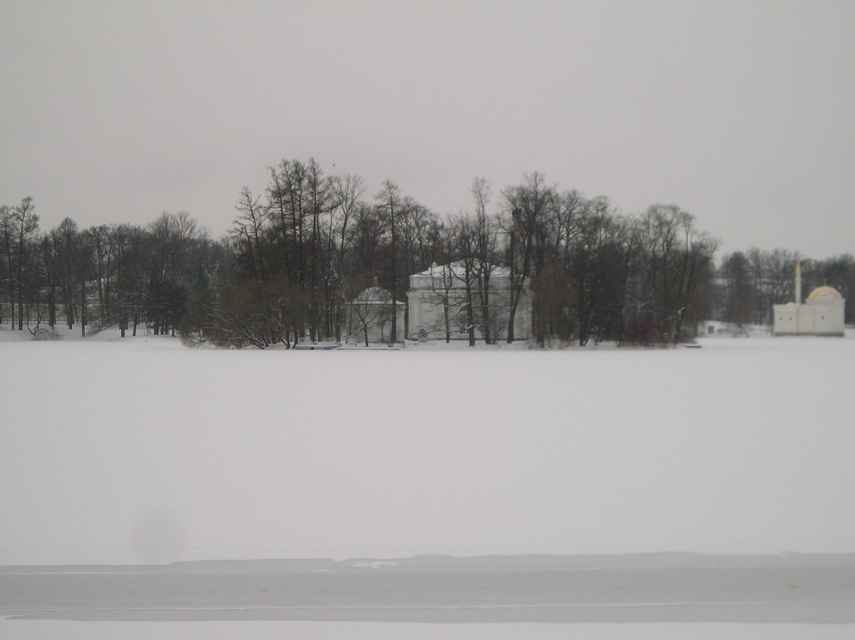
Which is in front, point (310, 376) or point (587, 230)?

Point (310, 376) is more forward.

Measure the distance between point (529, 532) and camera.

Point (529, 532) and camera are 38.52 feet apart.

Locate an element on the screen. white matte snow at center is located at coordinates (428, 492).